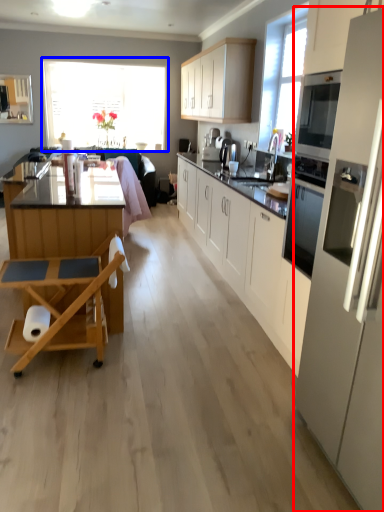
Question: Which object is further to the camera taking this photo, kitchen appliance (highlighted by a red box) or window (highlighted by a blue box)?

Choices:
 (A) kitchen appliance
 (B) window

Answer: (B)